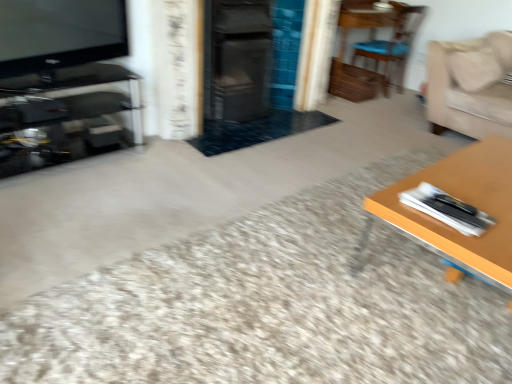
Question: From the image's perspective, would you say wooden table at right is positioned over wooden chair at upper right?

Choices:
 (A) no
 (B) yes

Answer: (A)

Question: Does wooden table at right contain wooden chair at upper right?

Choices:
 (A) no
 (B) yes

Answer: (A)

Question: Are wooden table at right and wooden chair at upper right located far from each other?

Choices:
 (A) yes
 (B) no

Answer: (A)

Question: Can you confirm if wooden table at right is taller than wooden chair at upper right?

Choices:
 (A) yes
 (B) no

Answer: (B)

Question: Is wooden table at right at the right side of wooden chair at upper right?

Choices:
 (A) no
 (B) yes

Answer: (A)

Question: Does wooden table at right have a larger size compared to wooden chair at upper right?

Choices:
 (A) yes
 (B) no

Answer: (A)

Question: Is wooden chair at upper right shorter than black glass entertainment center at left?

Choices:
 (A) yes
 (B) no

Answer: (B)

Question: Is wooden chair at upper right not close to black glass entertainment center at left?

Choices:
 (A) no
 (B) yes

Answer: (B)

Question: Can you confirm if wooden chair at upper right is thinner than black glass entertainment center at left?

Choices:
 (A) yes
 (B) no

Answer: (A)

Question: Does wooden chair at upper right turn towards black glass entertainment center at left?

Choices:
 (A) no
 (B) yes

Answer: (A)

Question: Does wooden chair at upper right have a greater width compared to black glass entertainment center at left?

Choices:
 (A) yes
 (B) no

Answer: (B)

Question: Is wooden chair at upper right further to camera compared to black glass entertainment center at left?

Choices:
 (A) yes
 (B) no

Answer: (A)

Question: Is beige fabric couch at upper right shorter than wooden table at right?

Choices:
 (A) yes
 (B) no

Answer: (B)